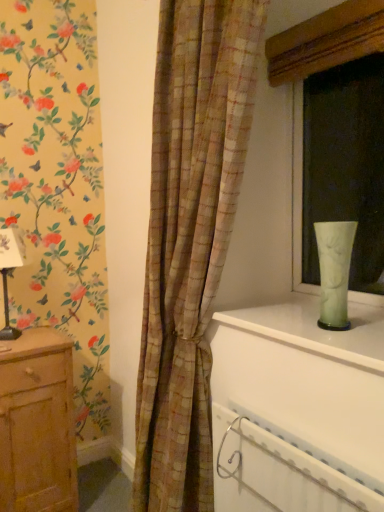
Locate an element on the screen. The width and height of the screenshot is (384, 512). free spot above matte glass vase at right (from a real-world perspective) is located at coordinates (308, 15).